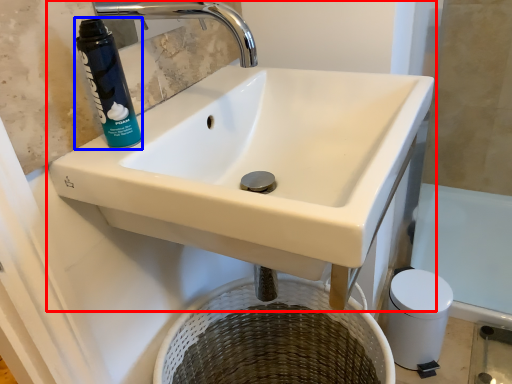
Question: Which of the following is the farthest to the observer, sink (highlighted by a red box) or cleaning product (highlighted by a blue box)?

Choices:
 (A) sink
 (B) cleaning product

Answer: (B)